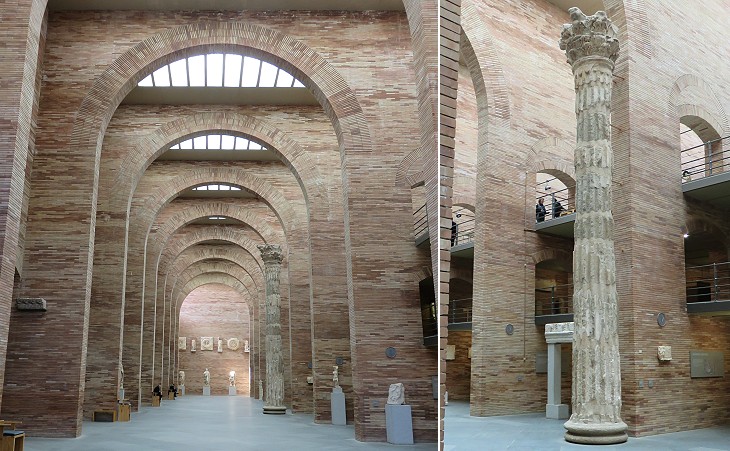
You are a GUI agent. You are given a task and a screenshot of the screen. Output one action in this format:
    pyautogui.click(x=<x>, y=<y>)
    Task: Click on the archway
    This screenshot has width=730, height=451.
    Given the screenshot: What is the action you would take?
    pyautogui.click(x=220, y=35), pyautogui.click(x=220, y=118), pyautogui.click(x=218, y=172), pyautogui.click(x=217, y=206), pyautogui.click(x=217, y=234), pyautogui.click(x=215, y=250), pyautogui.click(x=217, y=271)